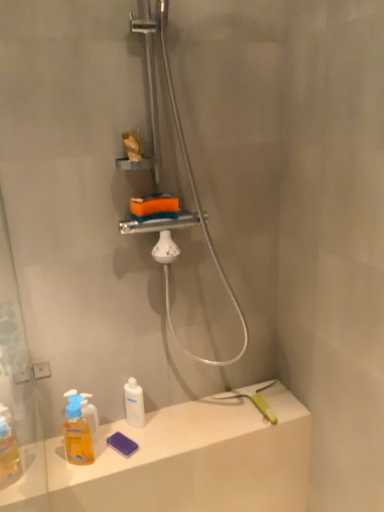
At what (x,y) coordinates should I click in order to perform the action: click on spots to the right of white glossy bottle at lower center, positioned as the first mouthwash in back-to-front order. Please return your answer as a coordinate pair (x, y). Looking at the image, I should click on (180, 424).